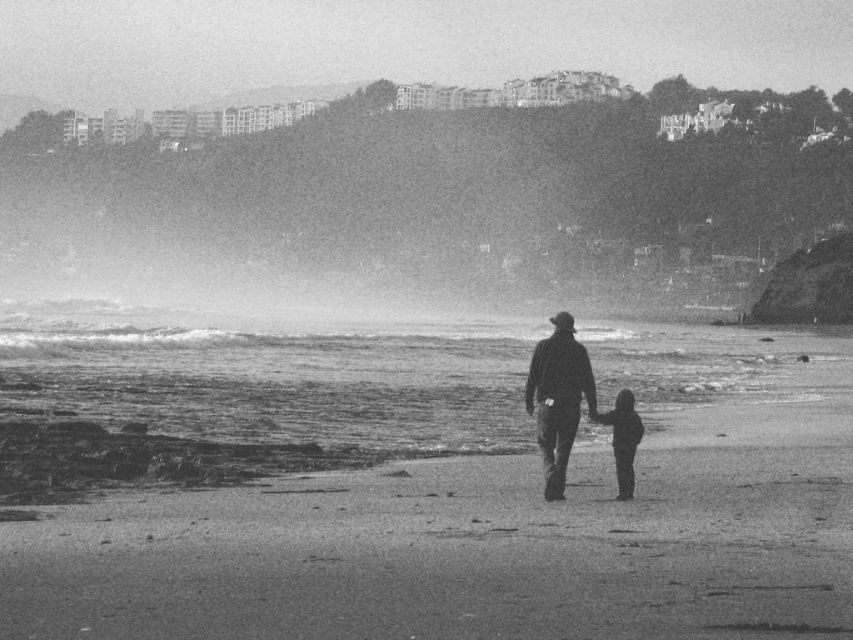
Which is above, smooth sand beach at center or dark gray fabric jacket at center?

dark gray fabric jacket at center is above.

Is smooth sand beach at center bigger than dark gray fabric jacket at center?

Yes, smooth sand beach at center is bigger than dark gray fabric jacket at center.

Who is more forward, (206, 616) or (556, 454)?

Point (206, 616) is more forward.

This screenshot has height=640, width=853. Find the location of `smooth sand beach at center`. smooth sand beach at center is located at coordinates (489, 532).

Is point (126, 372) positioned in front of point (611, 429)?

No, it is not.

Which is behind, point (415, 477) or point (637, 440)?

The point (415, 477) is more distant.

Between point (709, 573) and point (616, 396), which one is positioned behind?

Positioned behind is point (616, 396).

Where is `smooth sand beach at center`? This screenshot has width=853, height=640. smooth sand beach at center is located at coordinates click(489, 532).

Does dark gray fabric jacket at center have a greater height compared to dark fabric child at lower center?

Correct, dark gray fabric jacket at center is much taller as dark fabric child at lower center.

The height and width of the screenshot is (640, 853). What do you see at coordinates (558, 397) in the screenshot?
I see `dark gray fabric jacket at center` at bounding box center [558, 397].

At what (x,y) coordinates should I click in order to perform the action: click on dark gray fabric jacket at center. Please return your answer as a coordinate pair (x, y). This screenshot has width=853, height=640. Looking at the image, I should click on (558, 397).